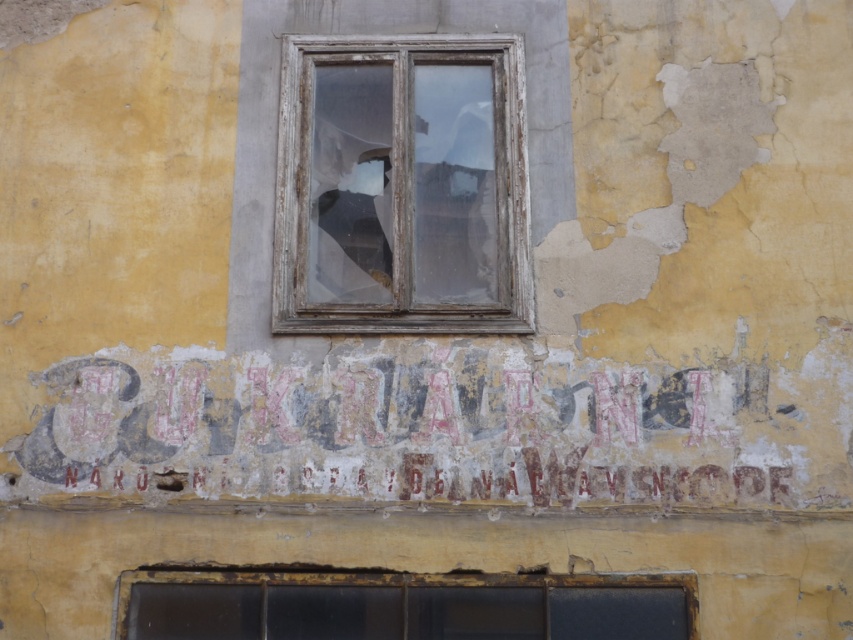
This screenshot has width=853, height=640. Describe the element at coordinates (401, 186) in the screenshot. I see `wooden-framed glass window at center` at that location.

Consider the image. Which of these two, wooden-framed glass window at center or matte glass window at lower center, stands shorter?

matte glass window at lower center

This screenshot has width=853, height=640. What do you see at coordinates (401, 186) in the screenshot?
I see `wooden-framed glass window at center` at bounding box center [401, 186].

Locate an element on the screen. wooden-framed glass window at center is located at coordinates (401, 186).

Which is below, faded red paint sign at center or wooden-framed glass window at center?

faded red paint sign at center is below.

Does point (758, 388) come farther from viewer compared to point (524, 218)?

No.

This screenshot has width=853, height=640. Find the location of `faded red paint sign at center`. faded red paint sign at center is located at coordinates point(402,429).

Identify the location of faded red paint sign at center. This screenshot has width=853, height=640. (402, 429).

Which is above, faded red paint sign at center or matte glass window at lower center?

Positioned higher is faded red paint sign at center.

Is point (305, 365) farther from camera compared to point (627, 580)?

That is True.

This screenshot has width=853, height=640. I want to click on faded red paint sign at center, so click(402, 429).